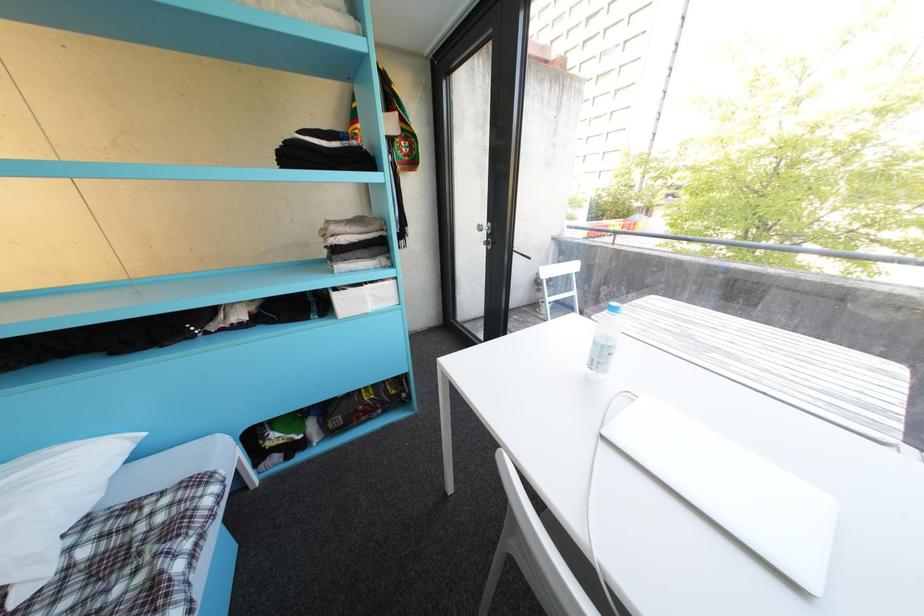
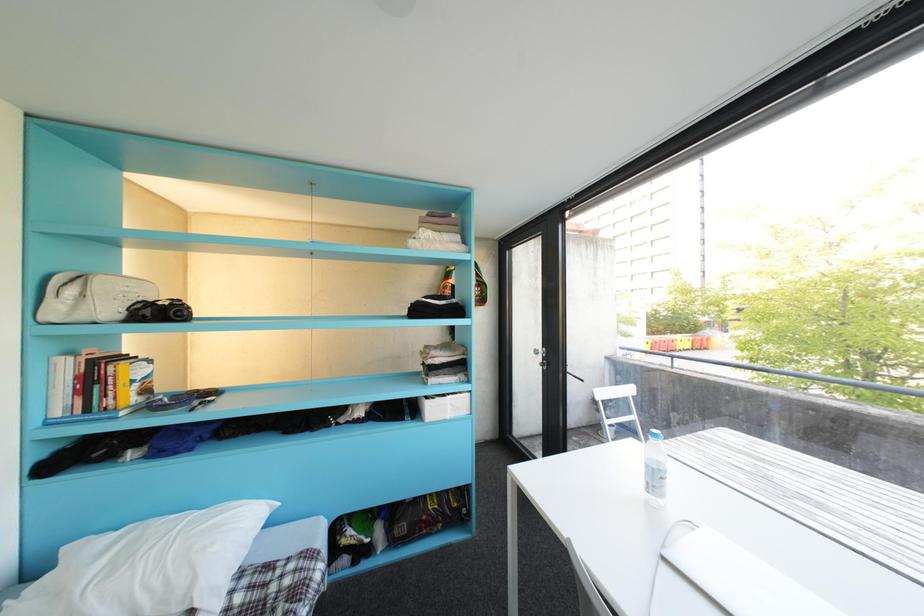
Question: Based on the continuous images, in which direction is the camera rotating? Reply with the corresponding letter.

Choices:
 (A) Left
 (B) Right
 (C) Up
 (D) Down

Answer: (C)